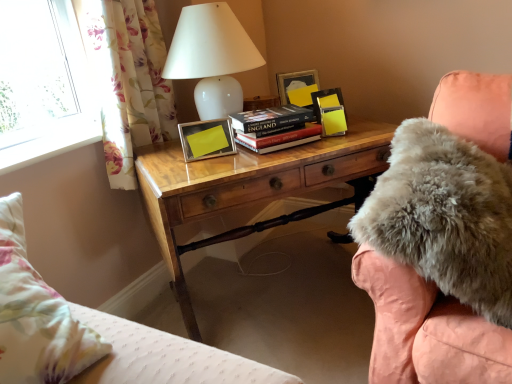
Question: Would you say floral fabric curtain at left is inside or outside hardcover book at center?

Choices:
 (A) inside
 (B) outside

Answer: (B)

Question: From a real-world perspective, is floral fabric curtain at left above or below hardcover book at center?

Choices:
 (A) below
 (B) above

Answer: (B)

Question: Estimate the real-world distances between objects in this image. Which object is farther from the white glossy table lamp at upper center?

Choices:
 (A) floral fabric curtain at left
 (B) metallic silver picture frame at center, the 1th picture frame from the front
 (C) wooden desk at center
 (D) hardcover book at center
 (E) yellow matte picture frame at upper right, which ranks as the 1th picture frame in top-to-bottom order

Answer: (C)

Question: Which is farther from the white glossy table lamp at upper center?

Choices:
 (A) wooden desk at center
 (B) floral fabric curtain at left
 (C) hardcover book at center
 (D) yellow matte picture frame at upper right, the 2th picture frame in the front-to-back sequence
 (E) fuzzy pink chair at right

Answer: (E)